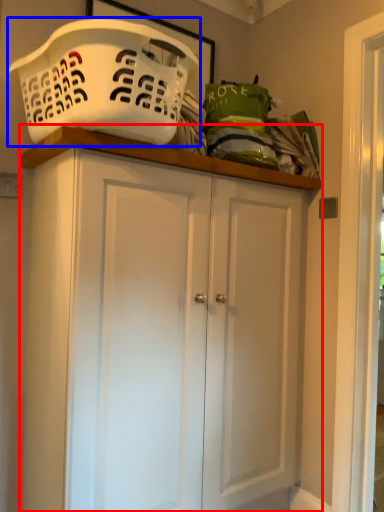
Question: Which object appears farthest to the camera in this image, cupboard (highlighted by a red box) or basket container (highlighted by a blue box)?

Choices:
 (A) cupboard
 (B) basket container

Answer: (A)